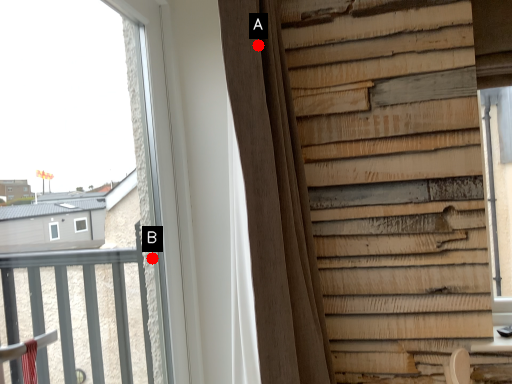
Question: Two points are circled on the image, labeled by A and B beside each circle. Which point is farther to the camera?

Choices:
 (A) A is further
 (B) B is further

Answer: (B)